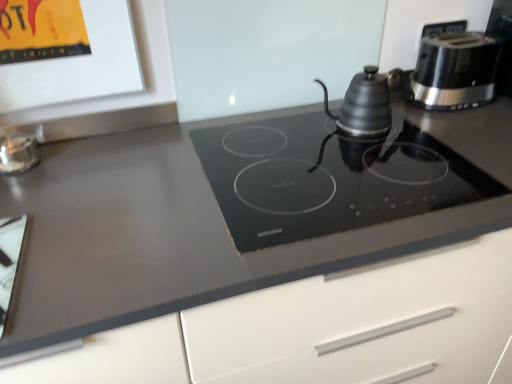
Locate an element on the screen. The image size is (512, 384). vacant point above black plastic toaster at upper right, arranged as the second kitchen appliance when viewed from the left (from a real-world perspective) is located at coordinates (455, 36).